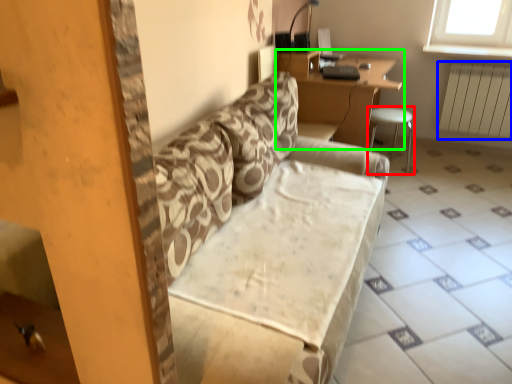
Question: Which is nearer to the furniture (highlighted by a red box)? radiator (highlighted by a blue box) or table (highlighted by a green box).

Choices:
 (A) radiator
 (B) table

Answer: (B)